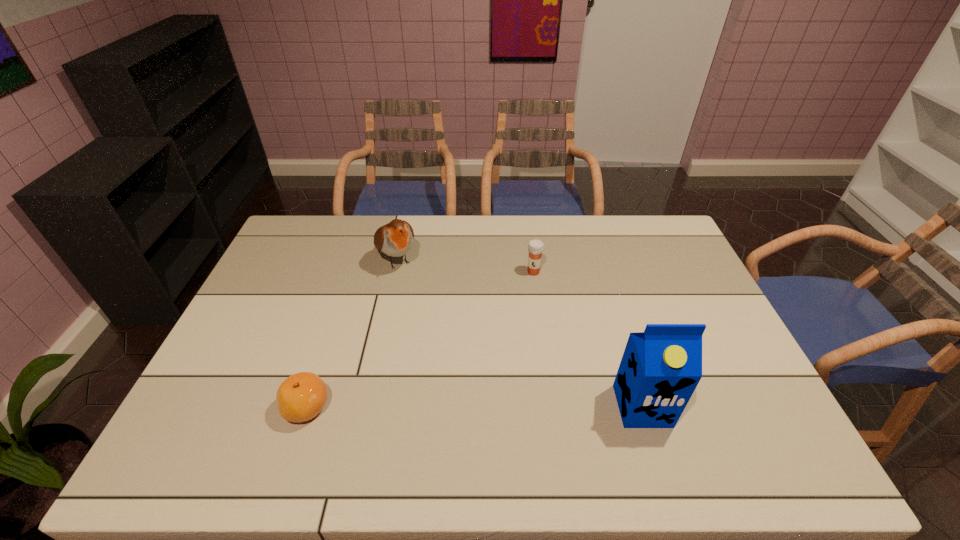
Identify the location of vacant space at the left edge of the desktop. This screenshot has width=960, height=540. (263, 320).

The image size is (960, 540). In the image, there is a desktop. What are the coordinates of `vacant space at the right edge` in the screenshot? It's located at click(x=677, y=276).

At what (x,y) coordinates should I click in order to perform the action: click on free space at the far right corner of the desktop. Please return your answer as a coordinate pair (x, y). Image resolution: width=960 pixels, height=540 pixels. Looking at the image, I should click on (663, 219).

Identify the location of vacant area that lies between the rightmost object and the bird. (519, 333).

The width and height of the screenshot is (960, 540). Identify the location of blank region between the shortest object and the second object from right to left. (420, 340).

This screenshot has height=540, width=960. In order to click on free space between the rightmost object and the clementine in this screenshot , I will do `click(474, 407)`.

The image size is (960, 540). What are the coordinates of `vacant area between the leftmost object and the rightmost object` in the screenshot? It's located at (474, 407).

The width and height of the screenshot is (960, 540). Identify the location of free space that is in between the tallest object and the third object from left to right. (588, 339).

Where is `vacant area that lies between the second object from left to right and the shortest object`? The height and width of the screenshot is (540, 960). vacant area that lies between the second object from left to right and the shortest object is located at coordinates (351, 333).

You are a GUI agent. You are given a task and a screenshot of the screen. Output one action in this format:
    pyautogui.click(x=<x>, y=<y>)
    Task: Click on the free space that is in between the clementine and the tallest object
    
    Given the screenshot: What is the action you would take?
    pyautogui.click(x=474, y=407)